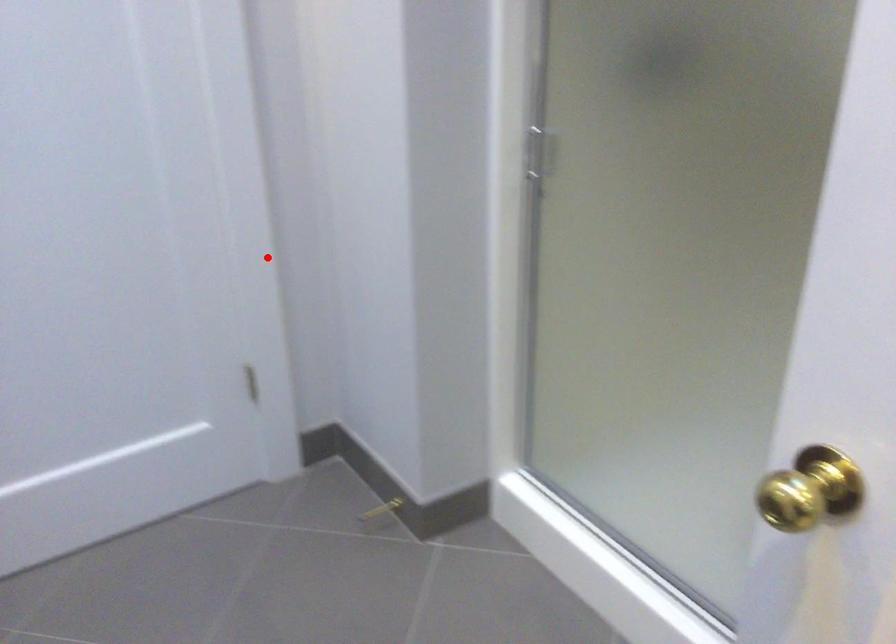
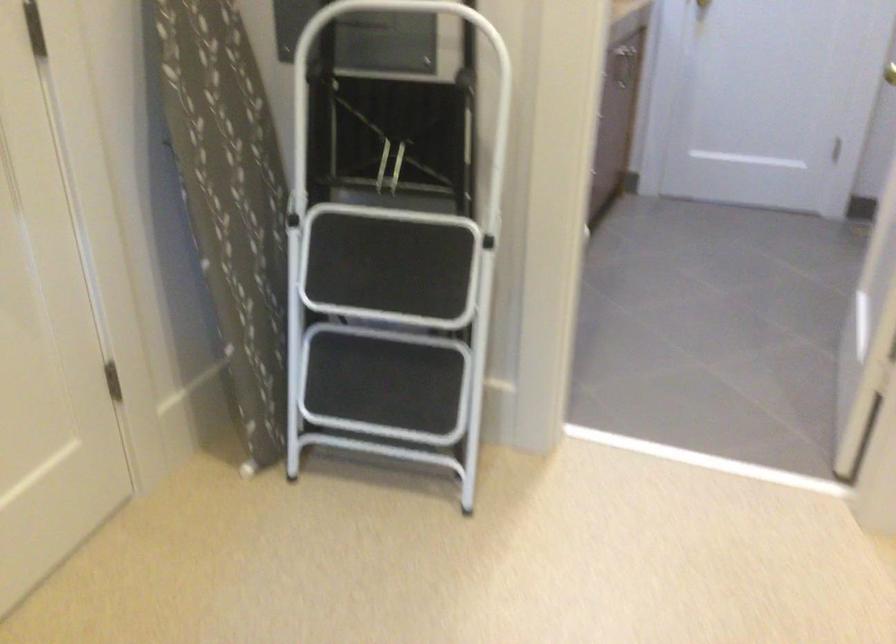
Question: I am providing you with two images of the same scene from different viewpoints. A red point is shown in image1. For the corresponding object point in image2, is it positioned nearer or farther from the camera?

Choices:
 (A) Nearer
 (B) Farther

Answer: (B)